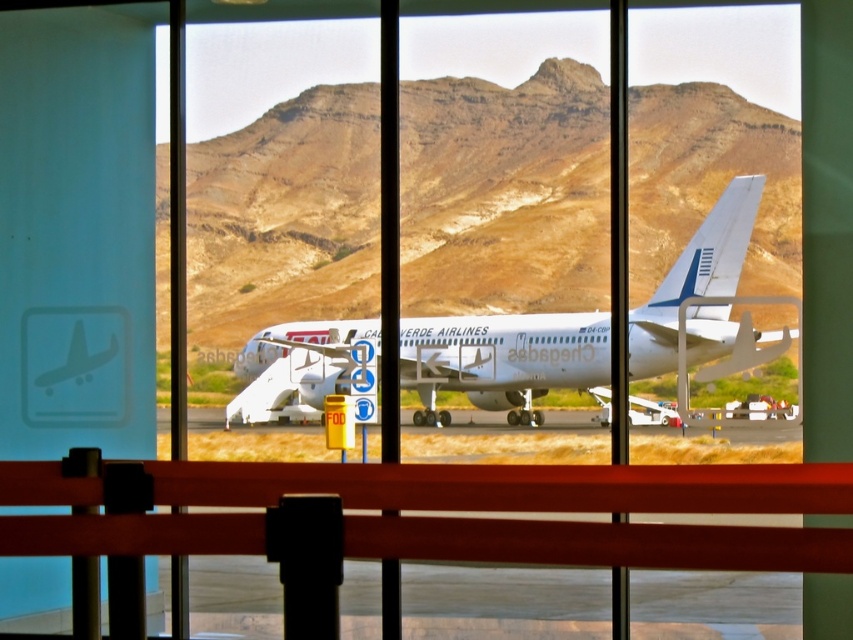
Question: Is brown rocky mountain at center to the left of white glossy airplane at center from the viewer's perspective?

Choices:
 (A) yes
 (B) no

Answer: (A)

Question: Which of the following is the farthest from the observer?

Choices:
 (A) brown rocky mountain at center
 (B) white glossy airplane at center
 (C) metallic red rail at center

Answer: (A)

Question: Considering the relative positions of brown rocky mountain at center and white glossy airplane at center in the image provided, where is brown rocky mountain at center located with respect to white glossy airplane at center?

Choices:
 (A) above
 (B) below

Answer: (A)

Question: Which object is farther from the camera taking this photo?

Choices:
 (A) white glossy airplane at center
 (B) brown rocky mountain at center

Answer: (B)

Question: Which point appears farthest from the camera in this image?

Choices:
 (A) (231, 524)
 (B) (718, 275)

Answer: (B)

Question: Is brown rocky mountain at center below metallic red rail at center?

Choices:
 (A) yes
 (B) no

Answer: (B)